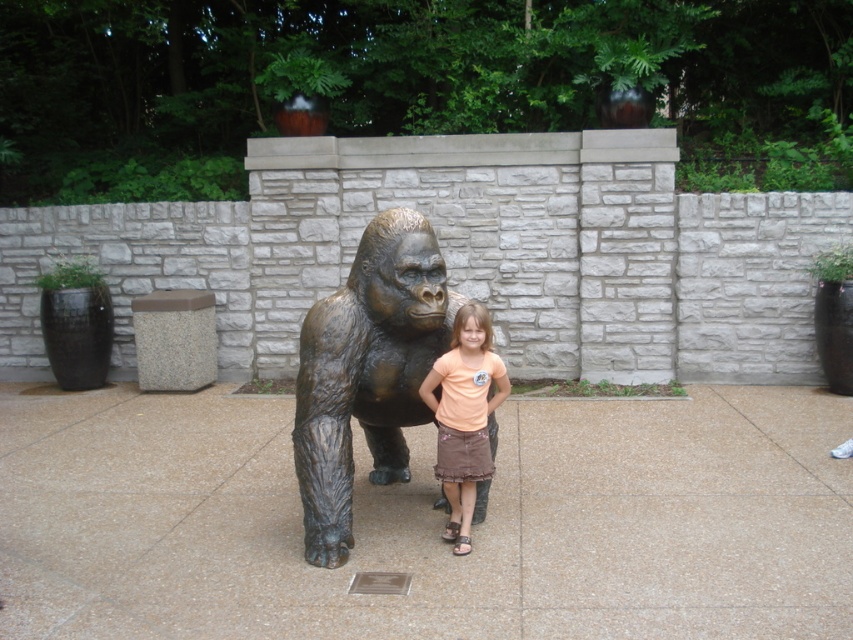
You are standing in front of the bronze textured gorilla at center and want to take a photo of it. If your camera has a maximum focus range of 15 feet, will you be able to capture the statue clearly?

The bronze textured gorilla at center is 13.93 feet away from the viewer, which is within the camera maximum focus range of 15 feet. Therefore, the statue can be captured clearly.